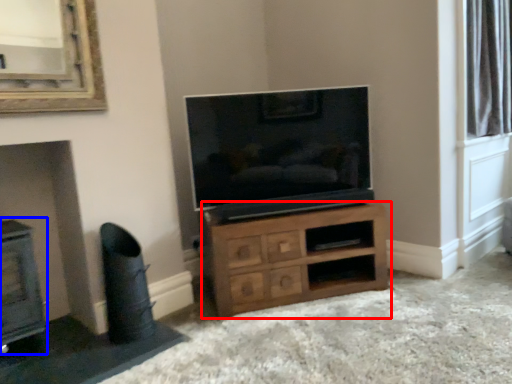
Question: Which object appears closest to the camera in this image, chest of drawers (highlighted by a red box) or fireplace (highlighted by a blue box)?

Choices:
 (A) chest of drawers
 (B) fireplace

Answer: (B)